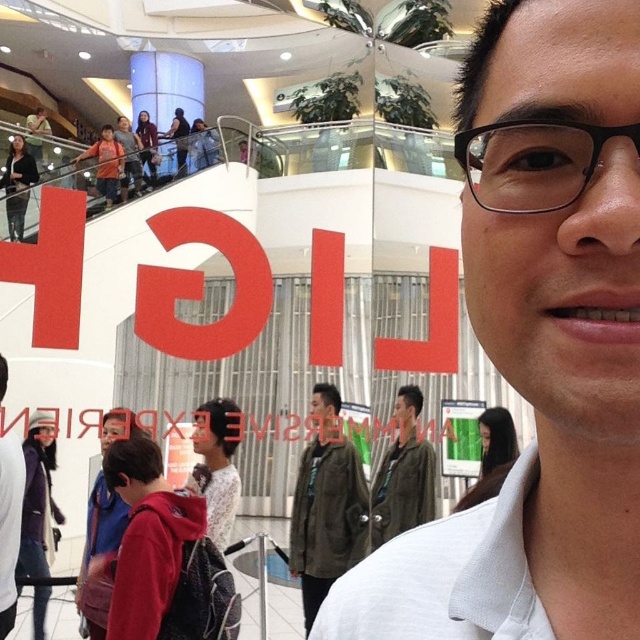
Does white matte shirt at center have a lesser height compared to red hoodie at lower left?

Yes, white matte shirt at center is shorter than red hoodie at lower left.

From the picture: Which is below, white matte shirt at center or red hoodie at lower left?

Positioned lower is red hoodie at lower left.

This screenshot has width=640, height=640. Describe the element at coordinates (538, 344) in the screenshot. I see `white matte shirt at center` at that location.

Locate an element on the screen. This screenshot has width=640, height=640. white matte shirt at center is located at coordinates (538, 344).

Between point (499, 131) and point (109, 548), which one is positioned in front?

Point (499, 131) is more forward.

Does black plastic glasses at upper right appear over red hoodie at lower left?

Yes, black plastic glasses at upper right is above red hoodie at lower left.

Between point (563, 136) and point (100, 508), which one is positioned in front?

Point (563, 136) is more forward.

At what (x,y) coordinates should I click in order to perform the action: click on black plastic glasses at upper right. Please return your answer as a coordinate pair (x, y). The width and height of the screenshot is (640, 640). Looking at the image, I should click on (532, 161).

Is point (474, 144) closer to viewer compared to point (420, 465)?

Yes, it is.

Who is more forward, (563, 136) or (374, 493)?

Positioned in front is point (563, 136).

Measure the distance between point (467, 161) and camera.

A distance of 4.46 feet exists between point (467, 161) and camera.

This screenshot has width=640, height=640. What are the coordinates of `black plastic glasses at upper right` in the screenshot? It's located at (532, 161).